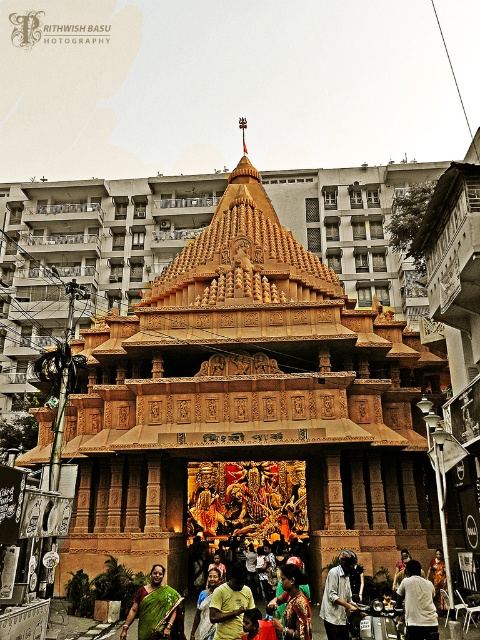
Between green silk saree at center and white fabric dress at lower center, which one has less height?

Standing shorter between the two is white fabric dress at lower center.

Does green silk saree at center have a lesser width compared to white fabric dress at lower center?

No.

What do you see at coordinates (154, 608) in the screenshot?
I see `green silk saree at center` at bounding box center [154, 608].

Identify the location of green silk saree at center. Image resolution: width=480 pixels, height=640 pixels. point(154,608).

Who is more distant from viewer, (349,582) or (410,582)?

Positioned behind is point (349,582).

Where is `dark gray fabric jacket at lower center`? dark gray fabric jacket at lower center is located at coordinates (338, 596).

Between point (324, 600) and point (408, 579), which one is positioned behind?

The point (324, 600) is behind.

This screenshot has width=480, height=640. Identify the location of dark gray fabric jacket at lower center. (338, 596).

Measure the distance from white cotton shirt at lower right to matte gold statue at center.

They are 7.95 meters apart.

The height and width of the screenshot is (640, 480). Describe the element at coordinates (418, 604) in the screenshot. I see `white cotton shirt at lower right` at that location.

Is point (416, 616) positioned before point (429, 577)?

That is True.

The height and width of the screenshot is (640, 480). I want to click on white cotton shirt at lower right, so click(418, 604).